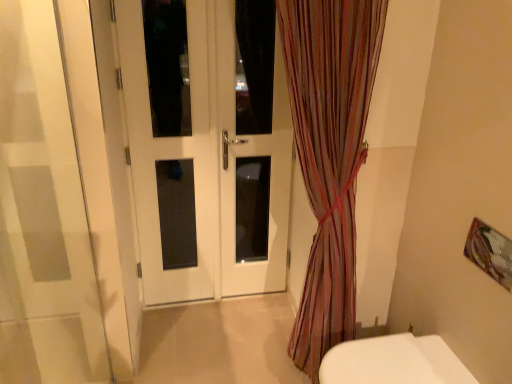
Where is `free space above white glossy toilet at lower right (from a real-world perspective)`? free space above white glossy toilet at lower right (from a real-world perspective) is located at coordinates (375, 363).